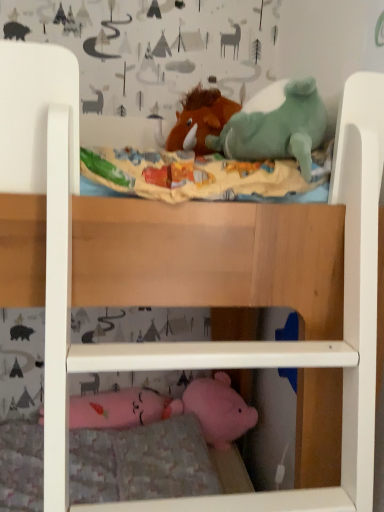
Question: Is pink plush at lower center at the right side of brown plush horse at upper center?

Choices:
 (A) yes
 (B) no

Answer: (B)

Question: From the image's perspective, is pink plush at lower center over brown plush horse at upper center?

Choices:
 (A) no
 (B) yes

Answer: (A)

Question: Would you say pink plush at lower center is a long distance from brown plush horse at upper center?

Choices:
 (A) yes
 (B) no

Answer: (A)

Question: Considering the relative sizes of pink plush at lower center and brown plush horse at upper center in the image provided, is pink plush at lower center taller than brown plush horse at upper center?

Choices:
 (A) no
 (B) yes

Answer: (A)

Question: Is brown plush horse at upper center at the back of pink plush at lower center?

Choices:
 (A) yes
 (B) no

Answer: (B)

Question: Could brown plush horse at upper center be considered to be inside pink plush at lower center?

Choices:
 (A) yes
 (B) no

Answer: (B)

Question: Considering the relative positions of brown plush horse at upper center and pink plush at lower center in the image provided, is brown plush horse at upper center to the right of pink plush at lower center from the viewer's perspective?

Choices:
 (A) yes
 (B) no

Answer: (A)

Question: Considering the relative sizes of brown plush horse at upper center and pink plush at lower center in the image provided, is brown plush horse at upper center bigger than pink plush at lower center?

Choices:
 (A) no
 (B) yes

Answer: (A)

Question: From the image's perspective, is brown plush horse at upper center located beneath pink plush at lower center?

Choices:
 (A) no
 (B) yes

Answer: (A)

Question: From the image's perspective, is brown plush horse at upper center over pink plush at lower center?

Choices:
 (A) no
 (B) yes

Answer: (B)

Question: Is brown plush horse at upper center next to pink plush at lower center?

Choices:
 (A) no
 (B) yes

Answer: (A)

Question: Considering the relative sizes of brown plush horse at upper center and pink plush at lower center in the image provided, is brown plush horse at upper center wider than pink plush at lower center?

Choices:
 (A) no
 (B) yes

Answer: (A)

Question: From the image's perspective, is brown plush horse at upper center above or below pink plush at lower center?

Choices:
 (A) above
 (B) below

Answer: (A)